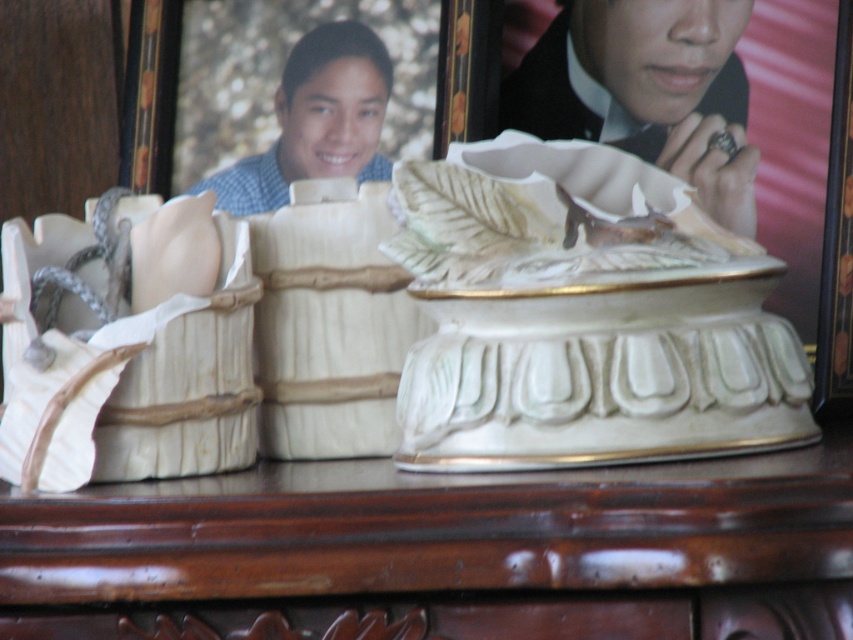
Between mahogany wood table at center and matte black ring at upper right, which one is positioned higher?

matte black ring at upper right is higher up.

Does mahogany wood table at center have a smaller size compared to matte black ring at upper right?

No, mahogany wood table at center is not smaller than matte black ring at upper right.

Is point (303, 563) positioned behind point (523, 93)?

No, it is not.

In order to click on mahogany wood table at center in this screenshot , I will do `click(437, 547)`.

Is porcelain leaf at center below blue checkered shirt at upper center?

Yes, porcelain leaf at center is below blue checkered shirt at upper center.

Is porcelain leaf at center positioned at the back of blue checkered shirt at upper center?

That is False.

Locate an element on the screen. porcelain leaf at center is located at coordinates (546, 214).

Find the location of a particular element. This screenshot has width=853, height=640. porcelain leaf at center is located at coordinates (x=546, y=214).

Does mahogany wood table at center appear on the right side of blue checkered shirt at upper center?

Correct, you'll find mahogany wood table at center to the right of blue checkered shirt at upper center.

Is mahogany wood table at center above blue checkered shirt at upper center?

Actually, mahogany wood table at center is below blue checkered shirt at upper center.

At what (x,y) coordinates should I click in order to perform the action: click on mahogany wood table at center. Please return your answer as a coordinate pair (x, y). Looking at the image, I should click on [437, 547].